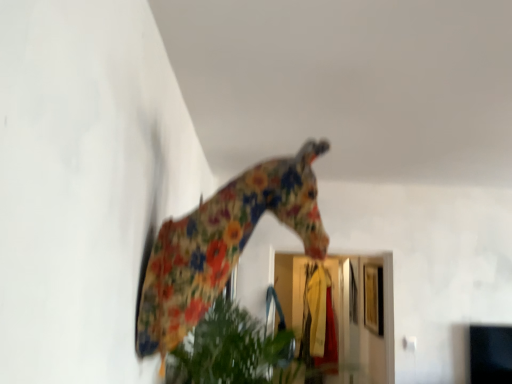
Question: From the image's perspective, relative to transparent glass door at center, is floral fabric giraffe at center above or below?

Choices:
 (A) above
 (B) below

Answer: (A)

Question: From a real-world perspective, is floral fabric giraffe at center above or below transparent glass door at center?

Choices:
 (A) above
 (B) below

Answer: (A)

Question: Is point (196, 301) positioned closer to the camera than point (355, 344)?

Choices:
 (A) farther
 (B) closer

Answer: (B)

Question: Is transparent glass door at center wider or thinner than floral fabric giraffe at center?

Choices:
 (A) thin
 (B) wide

Answer: (A)

Question: Is transparent glass door at center situated inside floral fabric giraffe at center or outside?

Choices:
 (A) outside
 (B) inside

Answer: (A)

Question: Looking at the image, does transparent glass door at center seem bigger or smaller compared to floral fabric giraffe at center?

Choices:
 (A) small
 (B) big

Answer: (A)

Question: Considering the positions of transparent glass door at center and floral fabric giraffe at center in the image, is transparent glass door at center taller or shorter than floral fabric giraffe at center?

Choices:
 (A) short
 (B) tall

Answer: (B)